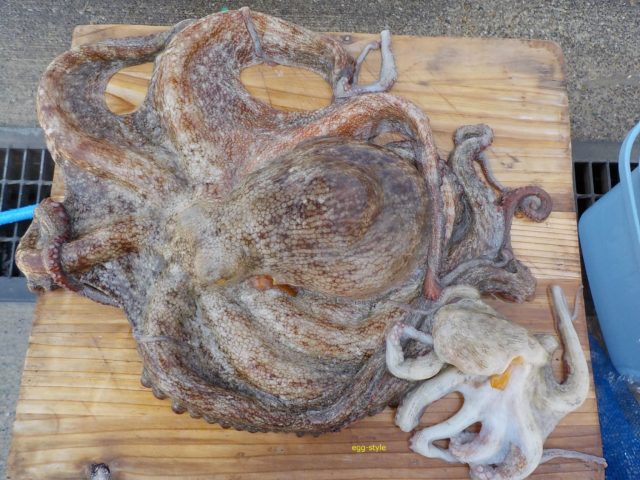
Find the location of a particular element. This screenshot has width=640, height=480. square table is located at coordinates point(73,416).